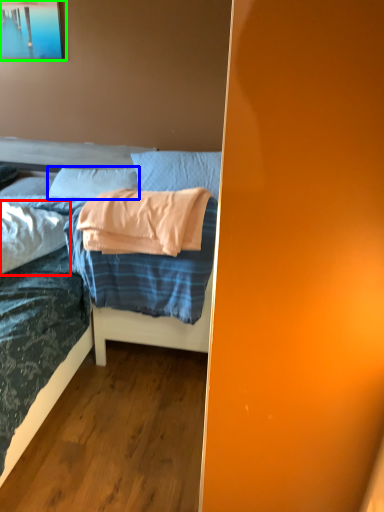
Question: Which is nearer to the pillow (highlighted by a red box)? pillow (highlighted by a blue box) or picture frame (highlighted by a green box).

Choices:
 (A) pillow
 (B) picture frame

Answer: (A)